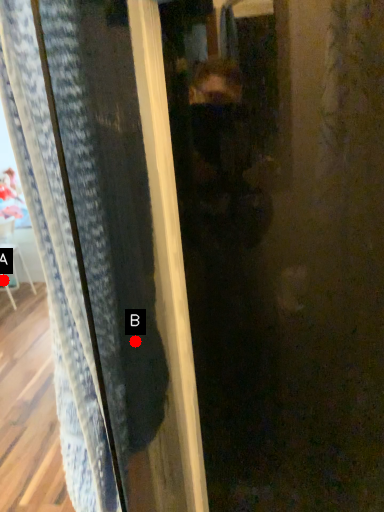
Question: Two points are circled on the image, labeled by A and B beside each circle. Which point is farther to the camera?

Choices:
 (A) A is further
 (B) B is further

Answer: (A)